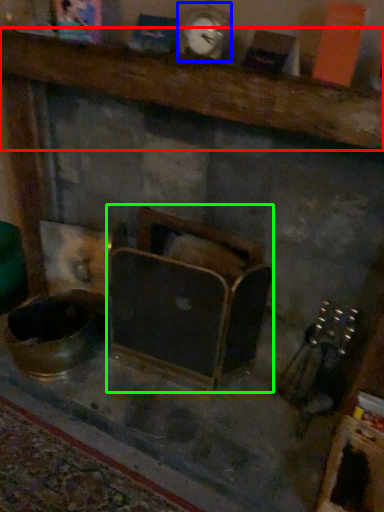
Question: Which is nearer to the furniture (highlighted by a red box)? clock (highlighted by a blue box) or furniture (highlighted by a green box).

Choices:
 (A) clock
 (B) furniture

Answer: (A)